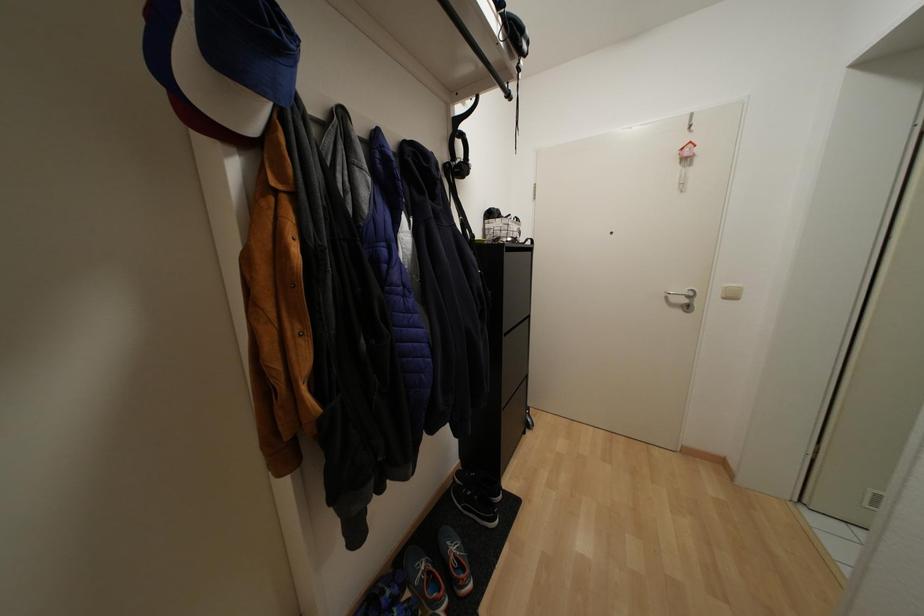
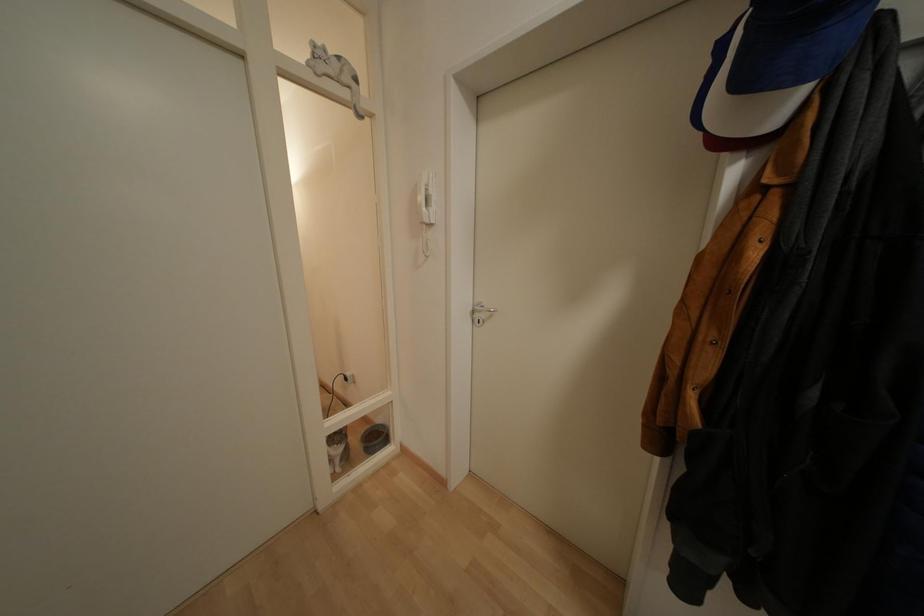
Based on the continuous images, in which direction is the camera rotating?

The rotation direction of the camera is left-down.